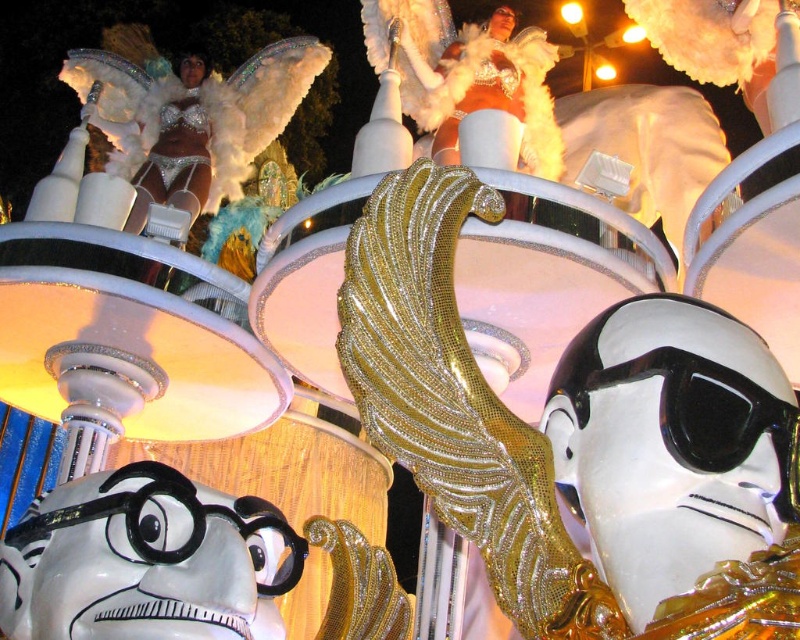
You are a photographer at the event and want to capture the gold glittery wing at center in your shot. Based on its position, where should you aim your camera?

The gold glittery wing at center is located at coordinates point (582, 440), so aim your camera at that position to capture it.

You are a costume designer preparing for a performance. You have two props to place on a stage backdrop. The gold glittery wing at center and the black glossy goggles at center. Given their sizes, which prop should you place in a position where size matters most for visibility?

The gold glittery wing at center should be placed in the position where size matters most for visibility since it is larger than the black glossy goggles at center, ensuring it can be seen clearly from a distance.